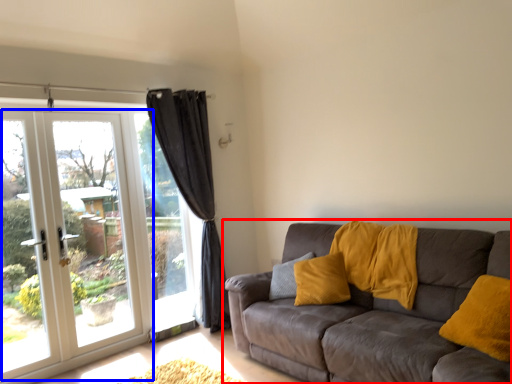
Question: Which object is further to the camera taking this photo, studio couch (highlighted by a red box) or door (highlighted by a blue box)?

Choices:
 (A) studio couch
 (B) door

Answer: (B)